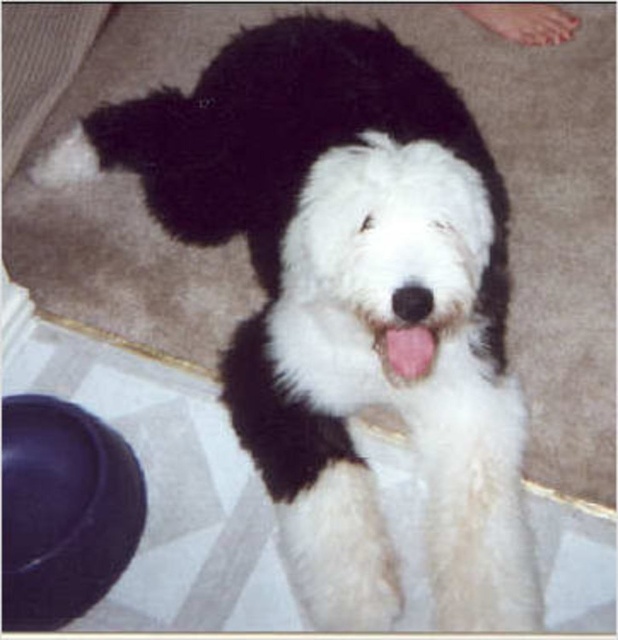
Question: Does white fur paw at upper right have a greater width compared to pink flesh at center?

Choices:
 (A) no
 (B) yes

Answer: (B)

Question: Which object appears closest to the camera in this image?

Choices:
 (A) pink flesh at center
 (B) white fur paw at upper right

Answer: (A)

Question: Does white fur paw at upper right come behind pink flesh at center?

Choices:
 (A) yes
 (B) no

Answer: (A)

Question: Can you confirm if white fur paw at upper right is positioned above pink flesh at center?

Choices:
 (A) no
 (B) yes

Answer: (B)